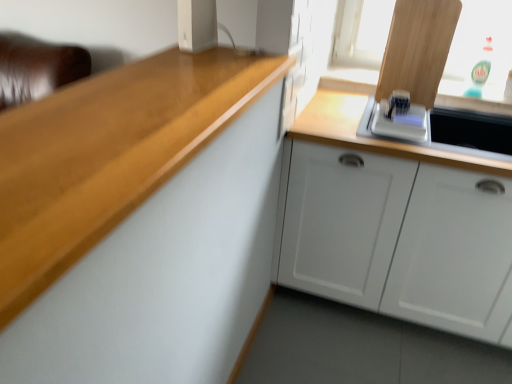
Question: Considering the relative positions of white glossy microwave at upper right and white plastic toaster at upper right, placed as the second appliance when sorted from front to back, in the image provided, is white glossy microwave at upper right to the left or to the right of white plastic toaster at upper right, placed as the second appliance when sorted from front to back,?

Choices:
 (A) left
 (B) right

Answer: (B)

Question: Is white glossy microwave at upper right situated inside white plastic toaster at upper right, which is the second appliance from left to right, or outside?

Choices:
 (A) inside
 (B) outside

Answer: (B)

Question: Which object is the closest to the white glossy microwave at upper right?

Choices:
 (A) wooden countertop at left, which is the 1th cabinetry from front to back
 (B) white plastic toaster at upper right, the 1th appliance when ordered from right to left
 (C) white plastic speaker at upper center, positioned as the 2th appliance in back-to-front order
 (D) white matte cabinet at lower right, positioned as the 2th cabinetry in front-to-back order

Answer: (B)

Question: Based on their relative distances, which object is farther from the white plastic toaster at upper right, placed as the second appliance when sorted from front to back?

Choices:
 (A) white matte cabinet at lower right, which is counted as the 2th cabinetry, starting from the left
 (B) white plastic speaker at upper center, the second appliance viewed from the right
 (C) white glossy microwave at upper right
 (D) wooden countertop at left, which ranks as the first cabinetry in left-to-right order

Answer: (D)